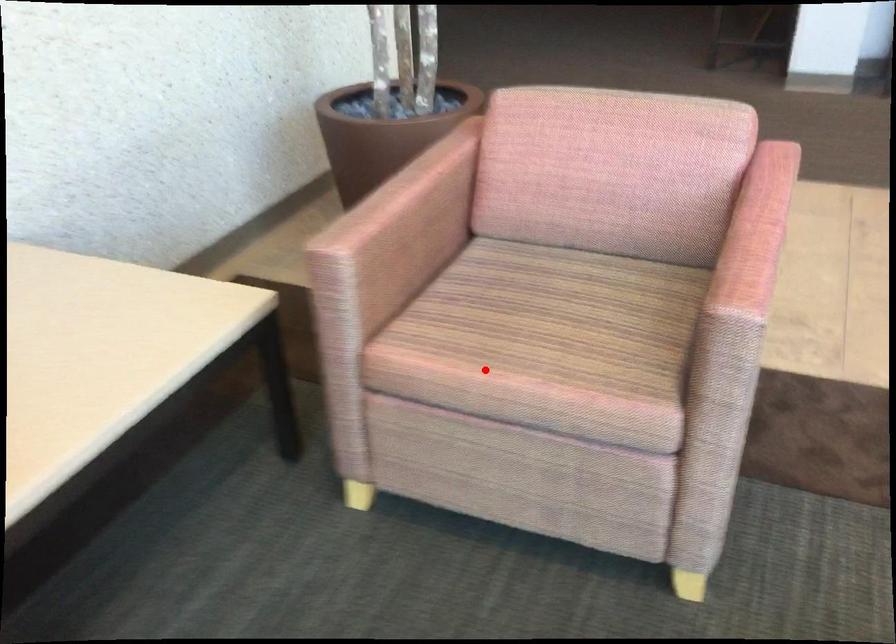
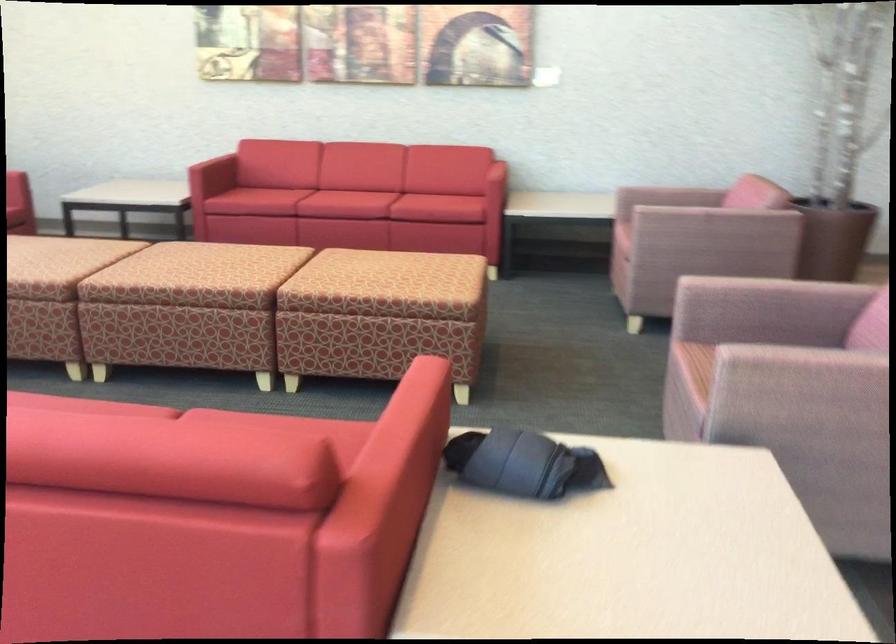
Locate, in the second image, the point that corresponds to the highlighted location in the first image.

(624, 218)